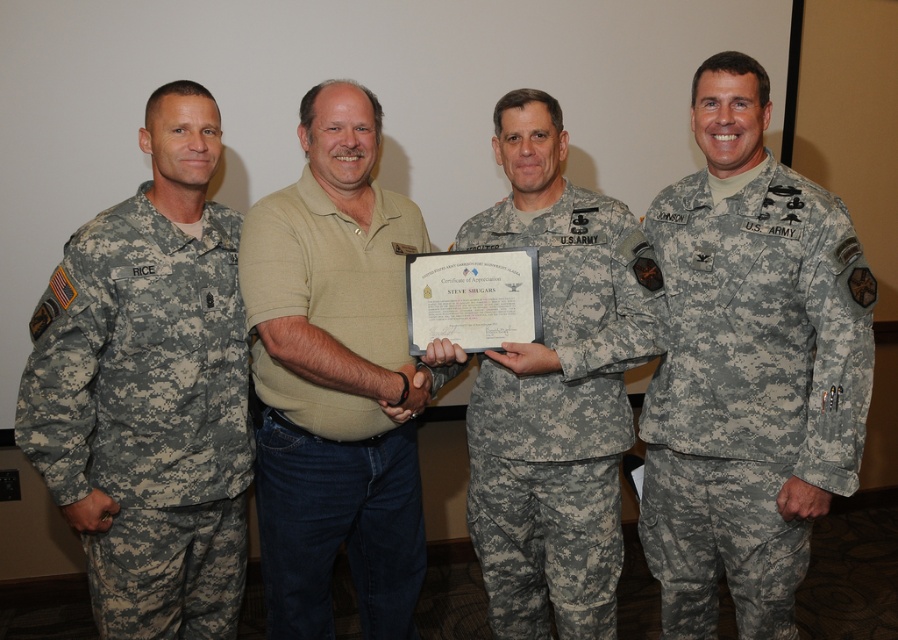
Question: Which of the following is the farthest from the observer?

Choices:
 (A) (78, 332)
 (B) (596, 540)
 (C) (821, 493)
 (D) (375, 593)

Answer: (D)

Question: Which point is closer to the camera taking this photo?

Choices:
 (A) (201, 488)
 (B) (648, 449)
 (C) (344, 387)

Answer: (C)

Question: Which object is the farthest from the camouflage fabric uniform at right?

Choices:
 (A) camouflage fabric uniform at center
 (B) camouflage fabric uniform at left
 (C) beige cotton polo shirt at center

Answer: (B)

Question: Can you confirm if camouflage fabric uniform at right is smaller than beige cotton polo shirt at center?

Choices:
 (A) no
 (B) yes

Answer: (B)

Question: Can you confirm if camouflage fabric uniform at right is thinner than camouflage fabric uniform at center?

Choices:
 (A) no
 (B) yes

Answer: (B)

Question: Can you confirm if camouflage fabric uniform at right is wider than beige cotton polo shirt at center?

Choices:
 (A) no
 (B) yes

Answer: (B)